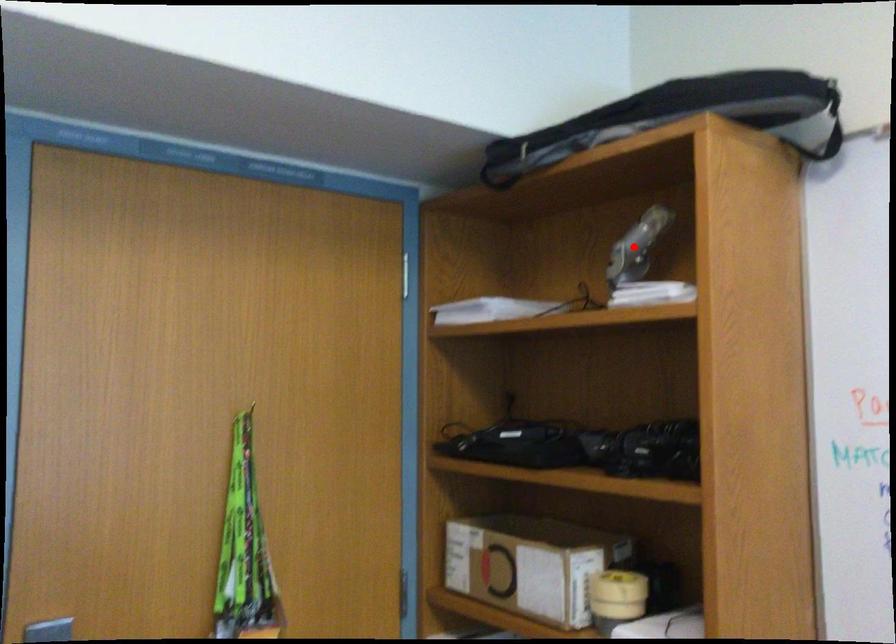
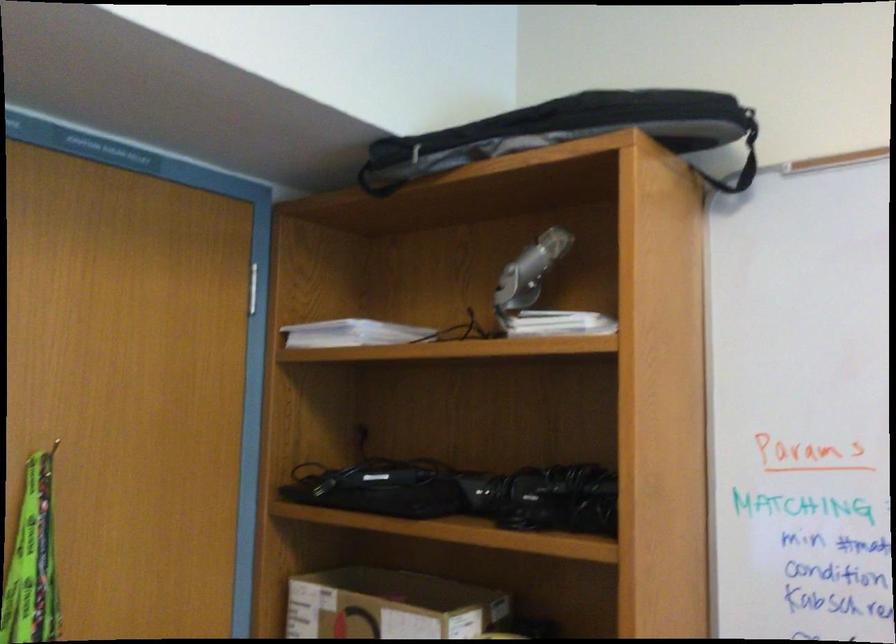
Find the pixel in the second image that matches the highlighted location in the first image.

(530, 270)